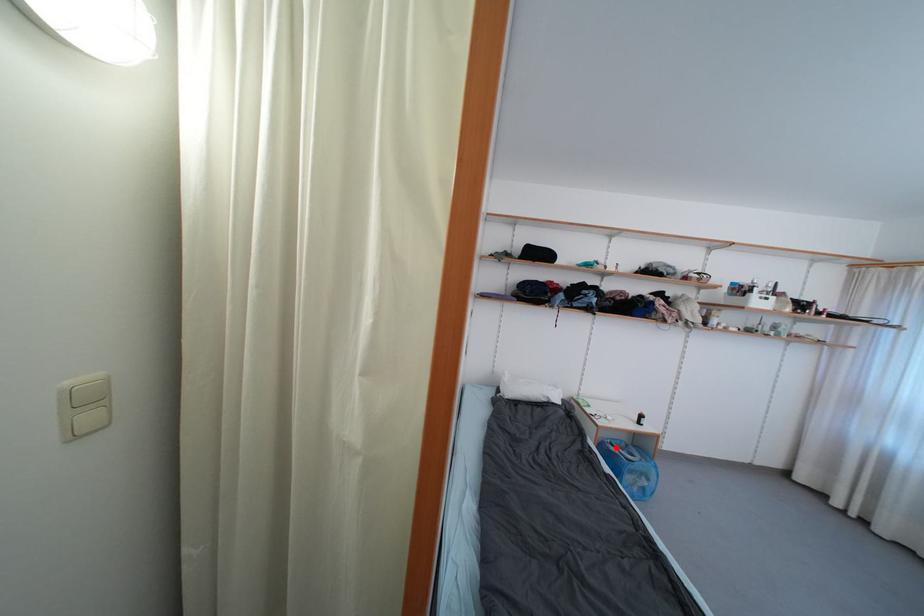
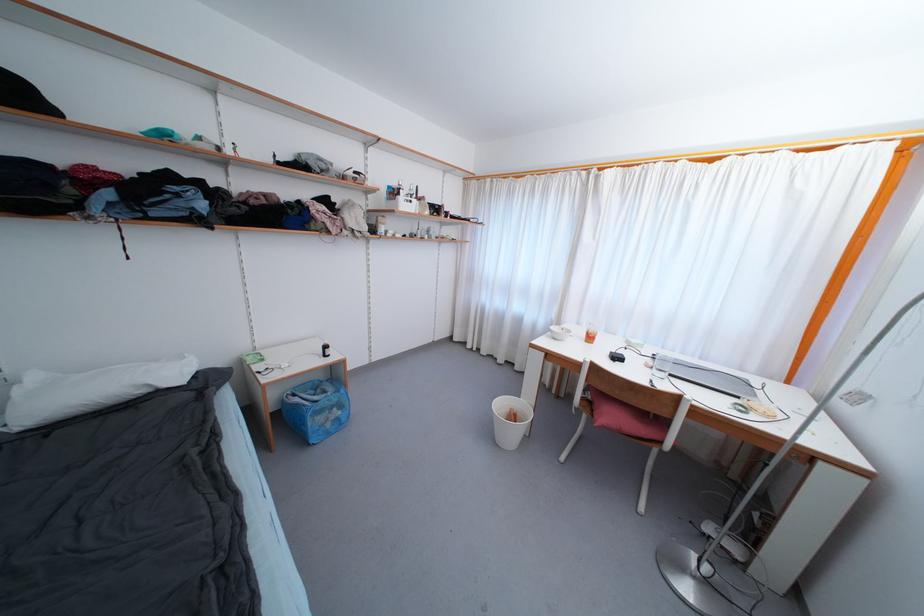
Question: I am providing you with two images of the same scene from different viewpoints. In image1, a red point is highlighted. Considering the same 3D point in image2, which of the following is correct?

Choices:
 (A) It is closer
 (B) It is farther

Answer: (A)